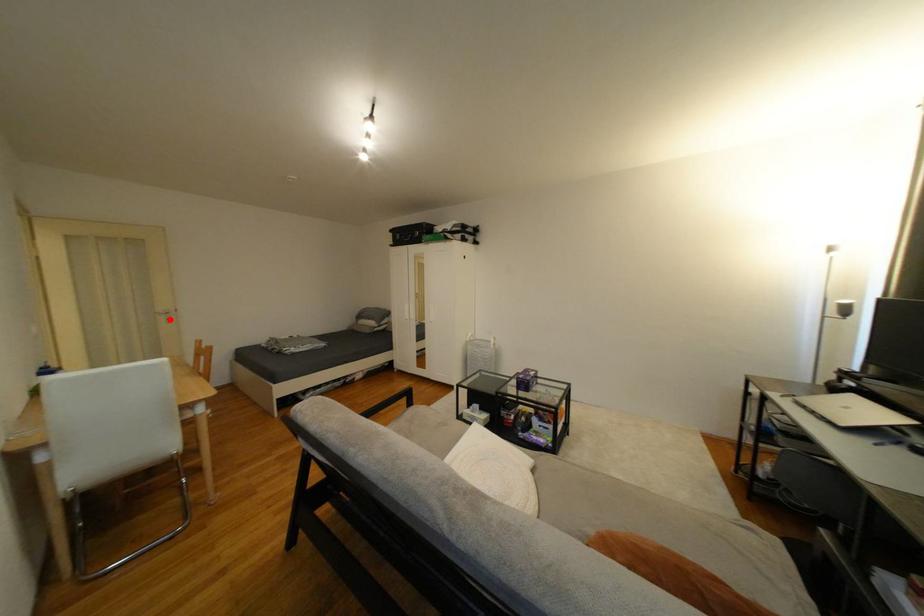
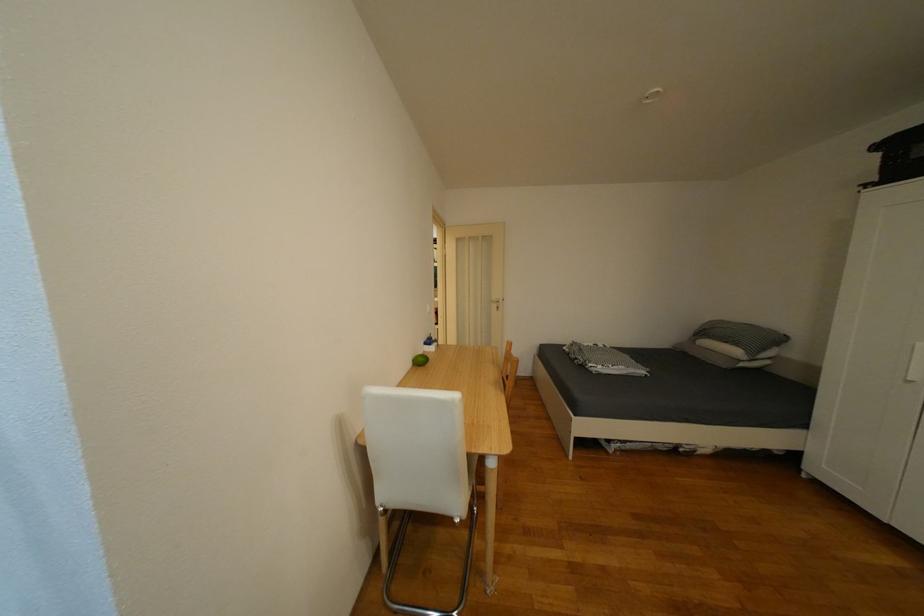
The point at the highlighted location is marked in the first image. Where is the corresponding point in the second image?

(503, 307)